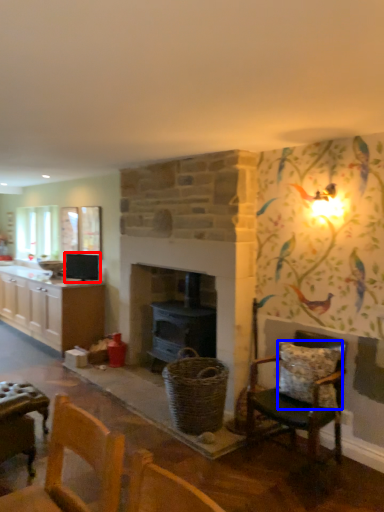
Question: Which object appears farthest to the camera in this image, appliance (highlighted by a red box) or pillow (highlighted by a blue box)?

Choices:
 (A) appliance
 (B) pillow

Answer: (A)